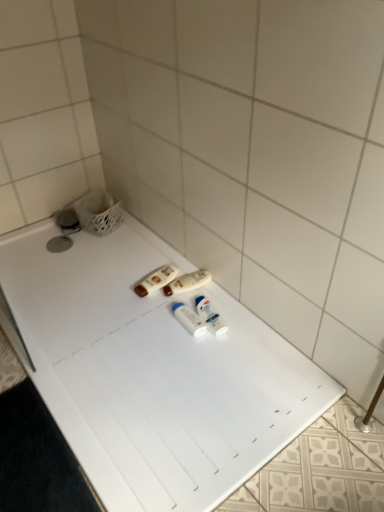
Image resolution: width=384 pixels, height=512 pixels. I want to click on free space to the left of white plastic bottles at center, the second toiletry positioned from the left, so click(x=136, y=293).